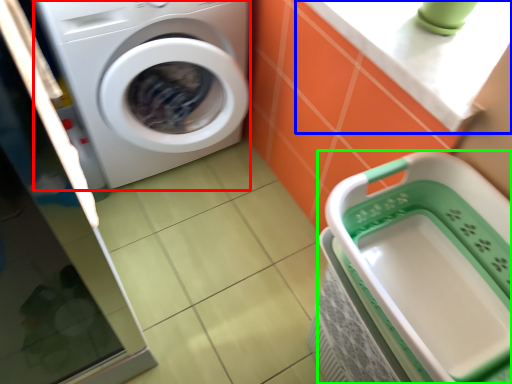
Question: Estimate the real-world distances between objects in this image. Which object is closer to washing machine (highlighted by a red box), counter top (highlighted by a blue box) or dish washer (highlighted by a green box)?

Choices:
 (A) counter top
 (B) dish washer

Answer: (A)